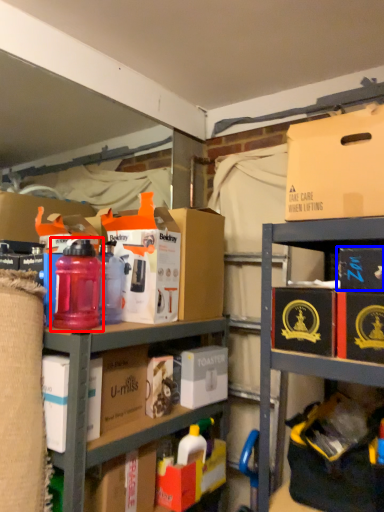
Question: Which object appears closest to the camera in this image, bottle (highlighted by a red box) or storage box (highlighted by a blue box)?

Choices:
 (A) bottle
 (B) storage box

Answer: (B)